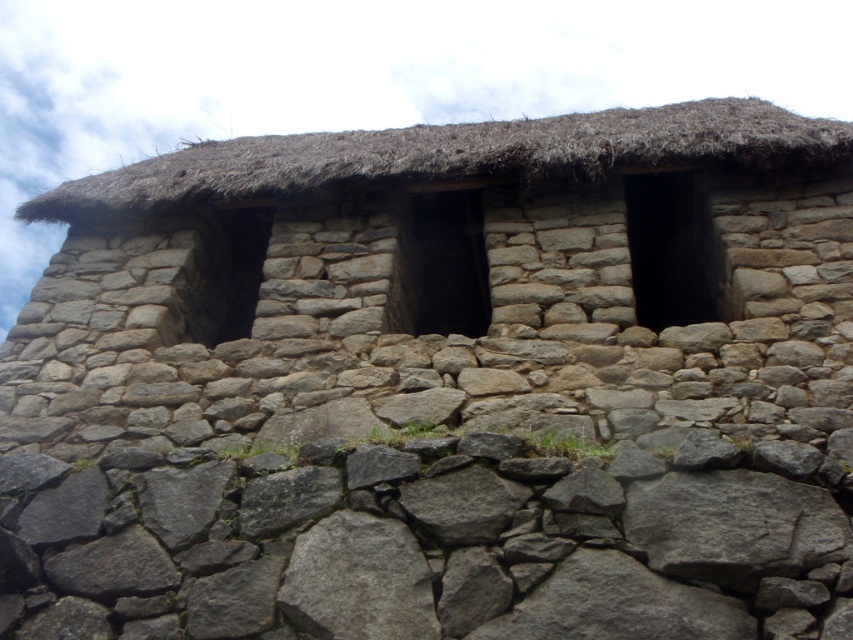
Question: Which of the following is the farthest from the observer?

Choices:
 (A) natural stone hut at center
 (B) gray rough stone at lower center

Answer: (A)

Question: Which object is positioned closest to the gray rough stone at lower center?

Choices:
 (A) natural stone hut at center
 (B) brown thatch at upper center

Answer: (A)

Question: Does gray rough stone at lower center have a lesser width compared to brown thatch at upper center?

Choices:
 (A) no
 (B) yes

Answer: (B)

Question: Is the position of gray rough stone at lower center less distant than that of brown thatch at upper center?

Choices:
 (A) yes
 (B) no

Answer: (A)

Question: Is natural stone hut at center above gray rough stone at lower center?

Choices:
 (A) no
 (B) yes

Answer: (B)

Question: Which point is closer to the camera?

Choices:
 (A) (607, 208)
 (B) (602, 168)

Answer: (B)